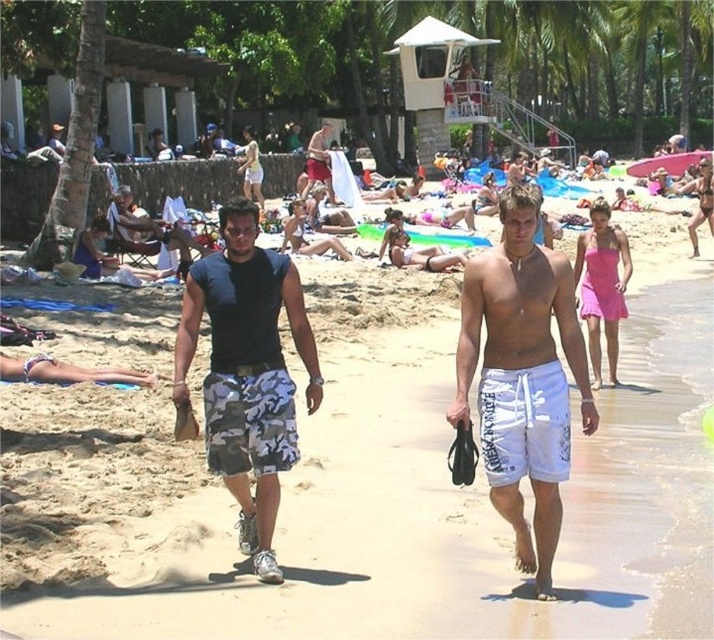
Question: Estimate the real-world distances between objects in this image. Which object is farther from the white cotton shorts at center?

Choices:
 (A) camo fabric shorts at center
 (B) camouflage shorts at center

Answer: (B)

Question: Where is white cotton shorts at center located in relation to camo fabric shorts at center in the image?

Choices:
 (A) right
 (B) left

Answer: (A)

Question: Does white cotton shorts at center have a greater width compared to camouflage shorts at center?

Choices:
 (A) yes
 (B) no

Answer: (B)

Question: Which point is closer to the camera?

Choices:
 (A) (226, 435)
 (B) (521, 330)

Answer: (B)

Question: Can you confirm if camo fabric shorts at center is bigger than camouflage shorts at center?

Choices:
 (A) yes
 (B) no

Answer: (B)

Question: Which point is farther to the camera?

Choices:
 (A) camo fabric shorts at center
 (B) camouflage shorts at center
 (C) white cotton shorts at center

Answer: (B)